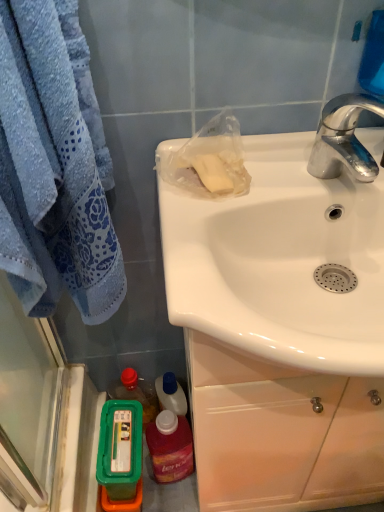
Question: Should I look upward or downward to see chrome metallic faucet at upper right?

Choices:
 (A) down
 (B) up

Answer: (B)

Question: From a real-world perspective, is green plastic container at lower left, the 2th mouthwash viewed from the right, positioned over translucent plastic mouthwash at lower left, the first mouthwash from the right, based on gravity?

Choices:
 (A) yes
 (B) no

Answer: (B)

Question: Is green plastic container at lower left, the first mouthwash in the left-to-right sequence, at the right side of translucent plastic mouthwash at lower left, the first mouthwash from the right?

Choices:
 (A) no
 (B) yes

Answer: (A)

Question: Does green plastic container at lower left, the 2th mouthwash viewed from the right, have a greater width compared to translucent plastic mouthwash at lower left, the first mouthwash from the right?

Choices:
 (A) yes
 (B) no

Answer: (A)

Question: Can you confirm if green plastic container at lower left, the 2th mouthwash viewed from the right, is shorter than translucent plastic mouthwash at lower left, the second mouthwash when ordered from left to right?

Choices:
 (A) yes
 (B) no

Answer: (A)

Question: Is green plastic container at lower left, the 2th mouthwash viewed from the right, next to translucent plastic mouthwash at lower left, the second mouthwash when ordered from left to right, and touching it?

Choices:
 (A) yes
 (B) no

Answer: (A)

Question: Is green plastic container at lower left, the 2th mouthwash viewed from the right, smaller than translucent plastic mouthwash at lower left, the second mouthwash when ordered from left to right?

Choices:
 (A) no
 (B) yes

Answer: (A)

Question: Is chrome metallic faucet at upper right further to camera compared to white glossy sink at upper right?

Choices:
 (A) yes
 (B) no

Answer: (A)

Question: Is chrome metallic faucet at upper right bigger than white glossy sink at upper right?

Choices:
 (A) yes
 (B) no

Answer: (B)

Question: From the image's perspective, would you say chrome metallic faucet at upper right is positioned over white glossy sink at upper right?

Choices:
 (A) yes
 (B) no

Answer: (A)

Question: Does chrome metallic faucet at upper right have a lesser height compared to white glossy sink at upper right?

Choices:
 (A) yes
 (B) no

Answer: (A)

Question: Is chrome metallic faucet at upper right taller than white glossy sink at upper right?

Choices:
 (A) no
 (B) yes

Answer: (A)

Question: Is chrome metallic faucet at upper right looking in the opposite direction of white glossy sink at upper right?

Choices:
 (A) yes
 (B) no

Answer: (B)

Question: Is translucent plastic mouthwash at lower left, the second mouthwash when ordered from left to right, in contact with chrome metallic faucet at upper right?

Choices:
 (A) no
 (B) yes

Answer: (A)